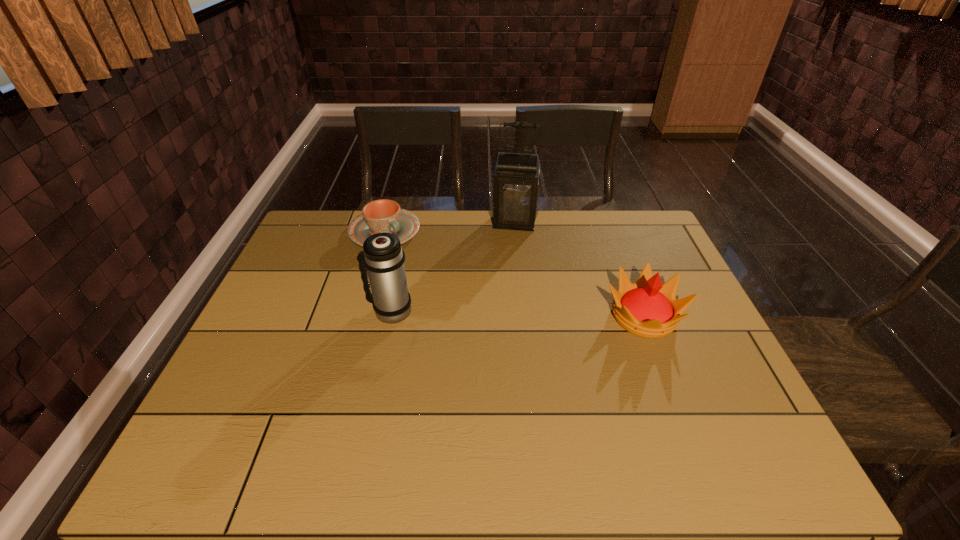
You are a GUI agent. You are given a task and a screenshot of the screen. Output one action in this format:
    pyautogui.click(x=<x>, y=<y>)
    Task: Click on the free space between the crown and the third shortest object
    The width and height of the screenshot is (960, 540).
    Given the screenshot: What is the action you would take?
    pyautogui.click(x=516, y=313)

The width and height of the screenshot is (960, 540). What are the coordinates of `empty space between the tallest object and the crown` in the screenshot? It's located at (579, 269).

Identify the location of free space that is in between the lantern and the crown. This screenshot has width=960, height=540. (579, 269).

Locate an element on the screen. Image resolution: width=960 pixels, height=540 pixels. vacant space in between the crown and the chinaware is located at coordinates (515, 274).

Where is `vacant space that is in between the shortest object and the rightmost object`? vacant space that is in between the shortest object and the rightmost object is located at coordinates (515, 274).

Where is `free space between the chinaware and the third object from left to right`? free space between the chinaware and the third object from left to right is located at coordinates (449, 227).

Where is `vacant region between the tallest object and the thermos bottle`? The width and height of the screenshot is (960, 540). vacant region between the tallest object and the thermos bottle is located at coordinates (452, 266).

The width and height of the screenshot is (960, 540). I want to click on vacant area that lies between the second shortest object and the second tallest object, so click(516, 313).

This screenshot has width=960, height=540. Identify the location of object identified as the second closest to the lantern. (647, 308).

Locate an element on the screen. object that is the third closest to the second tallest object is located at coordinates (647, 308).